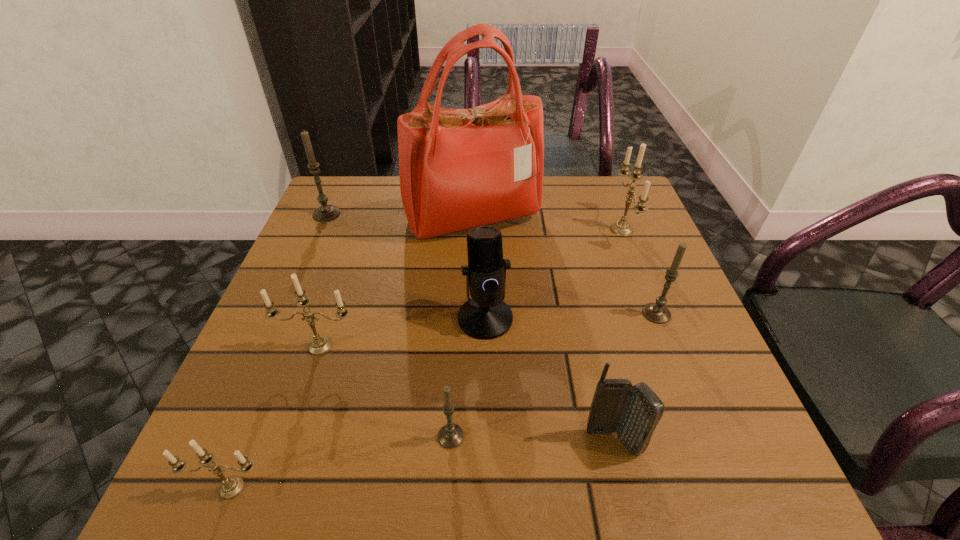
This screenshot has height=540, width=960. Find the location of `handbag`. handbag is located at coordinates (459, 168).

You are a GUI agent. You are given a task and a screenshot of the screen. Output one action in this format:
    pyautogui.click(x=<x>, y=<y>)
    Task: Click on the tallest object
    The image size is (960, 540).
    Given the screenshot: What is the action you would take?
    pyautogui.click(x=459, y=168)

The height and width of the screenshot is (540, 960). I want to click on the farthest metallic candle, so click(x=621, y=228).

Find the location of a particular element. The image size is (960, 540). the rightmost metallic candle is located at coordinates (621, 228).

The height and width of the screenshot is (540, 960). Find the location of `the leftmost gray candle`. the leftmost gray candle is located at coordinates (325, 212).

You are a GUI agent. You are given a task and a screenshot of the screen. Output one action in this format:
    pyautogui.click(x=<x>, y=<y>)
    Task: Click on the biggest gray candle
    Image resolution: width=960 pixels, height=540 pixels.
    Given the screenshot: What is the action you would take?
    pyautogui.click(x=325, y=212)

Identify the location of microphone. (486, 316).

What are the coordinates of `the rightmost gray candle` in the screenshot? It's located at (656, 312).

Locate an element on the screen. the second nearest gray candle is located at coordinates (656, 312).

Image resolution: width=960 pixels, height=540 pixels. I want to click on the fourth farthest candle, so click(320, 345).